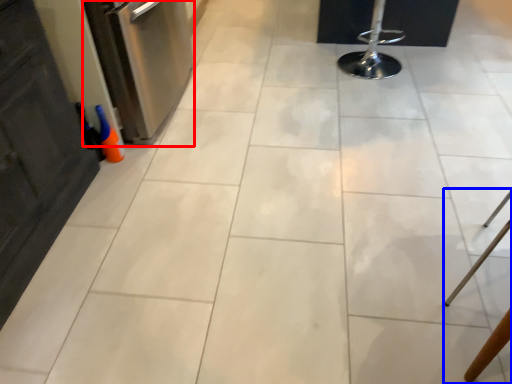
Question: Which object appears farthest to the camera in this image, dish washer (highlighted by a red box) or furniture (highlighted by a blue box)?

Choices:
 (A) dish washer
 (B) furniture

Answer: (A)